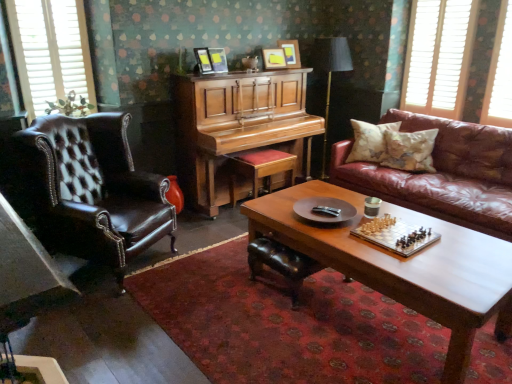
Question: Is there a large distance between wooden cushioned stool at center and white wooden blinds at upper right, placed as the third window when sorted from left to right?

Choices:
 (A) yes
 (B) no

Answer: (A)

Question: Is wooden cushioned stool at center in front of white wooden blinds at upper right, which is counted as the 1th window, starting from the right?

Choices:
 (A) yes
 (B) no

Answer: (B)

Question: Is wooden cushioned stool at center outside white wooden blinds at upper right, which is counted as the 1th window, starting from the right?

Choices:
 (A) no
 (B) yes

Answer: (B)

Question: Is wooden cushioned stool at center to the left of white wooden blinds at upper right, placed as the third window when sorted from left to right, from the viewer's perspective?

Choices:
 (A) no
 (B) yes

Answer: (B)

Question: Is the depth of wooden cushioned stool at center greater than that of white wooden blinds at upper right, which is counted as the 1th window, starting from the right?

Choices:
 (A) no
 (B) yes

Answer: (B)

Question: Does wooden cushioned stool at center have a greater height compared to white wooden blinds at upper right, placed as the third window when sorted from left to right?

Choices:
 (A) yes
 (B) no

Answer: (B)

Question: Is white wood window at upper left, which is the first window from left to right, closer to the viewer compared to brown leather wingback chair at left?

Choices:
 (A) yes
 (B) no

Answer: (B)

Question: Considering the relative sizes of white wood window at upper left, which is the first window from left to right, and brown leather wingback chair at left in the image provided, is white wood window at upper left, which is the first window from left to right, smaller than brown leather wingback chair at left?

Choices:
 (A) no
 (B) yes

Answer: (B)

Question: Is white wood window at upper left, arranged as the third window when viewed from the right, taller than brown leather wingback chair at left?

Choices:
 (A) no
 (B) yes

Answer: (A)

Question: Is brown leather wingback chair at left at the back of white wood window at upper left, arranged as the third window when viewed from the right?

Choices:
 (A) no
 (B) yes

Answer: (A)

Question: Is white wood window at upper left, arranged as the third window when viewed from the right, at the left side of brown leather wingback chair at left?

Choices:
 (A) no
 (B) yes

Answer: (B)

Question: From a real-world perspective, is white wood window at upper left, which is the first window from left to right, located beneath brown leather wingback chair at left?

Choices:
 (A) yes
 (B) no

Answer: (B)

Question: Considering the relative sizes of patterned fabric pillow at right, marked as the 2th pillow in a left-to-right arrangement, and white wood window at upper left, arranged as the third window when viewed from the right, in the image provided, is patterned fabric pillow at right, marked as the 2th pillow in a left-to-right arrangement, thinner than white wood window at upper left, arranged as the third window when viewed from the right,?

Choices:
 (A) no
 (B) yes

Answer: (A)